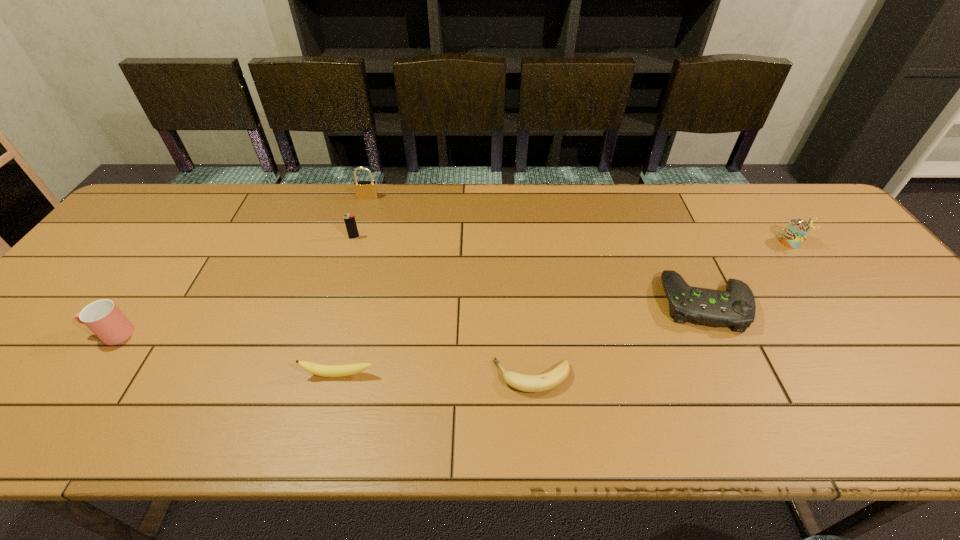
You are a GUI agent. You are given a task and a screenshot of the screen. Output one action in this format:
    pyautogui.click(x=<x>, y=<y>)
    Task: Click on the free point between the left banana and the padlock
    Image resolution: width=960 pixels, height=540 pixels.
    Given the screenshot: What is the action you would take?
    pyautogui.click(x=353, y=286)

In order to click on vacant area that lies between the left banana and the cup in this screenshot , I will do `click(226, 354)`.

Identify the location of vacant area between the padlock and the second object from right to left. The width and height of the screenshot is (960, 540). (537, 251).

At what (x,y) coordinates should I click in order to perform the action: click on free space between the left banana and the shorter banana. Please return your answer as a coordinate pair (x, y). Looking at the image, I should click on 436,376.

I want to click on object that ranks as the fourth closest to the igniter, so click(528, 383).

This screenshot has width=960, height=540. In order to click on object that is the second closest to the igniter in this screenshot , I will do `click(317, 369)`.

Find the location of a particular element. The image size is (960, 540). vacant point that satisfies the following two spatial constraints: 1. on the side of the sixth object from left to right with the handle; 2. on the right side of the cup is located at coordinates (134, 303).

You are a GUI agent. You are given a task and a screenshot of the screen. Output one action in this format:
    pyautogui.click(x=<x>, y=<y>)
    Task: Click on the vacant area in the image that satisfies the following two spatial constraints: 1. on the side of the igniter with the handle; 2. on the right side of the leftmost object
    The image size is (960, 540).
    Given the screenshot: What is the action you would take?
    pyautogui.click(x=180, y=238)